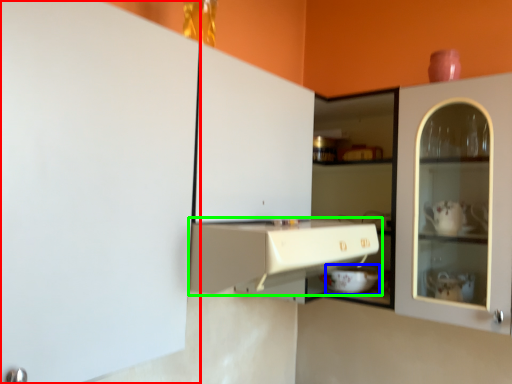
Question: Considering the real-world distances, which object is farthest from cabinetry (highlighted by a red box)? appliance (highlighted by a blue box) or cabinetry (highlighted by a green box)?

Choices:
 (A) appliance
 (B) cabinetry

Answer: (A)